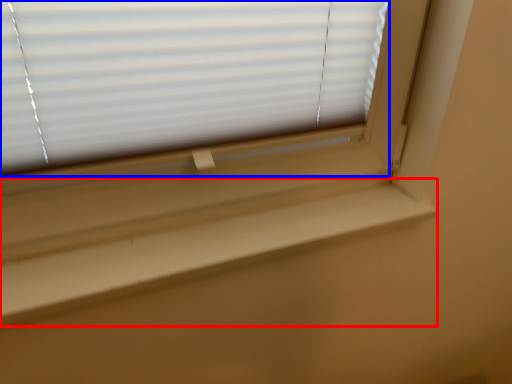
Question: Which point is further to the camera, window sill (highlighted by a red box) or window blind (highlighted by a blue box)?

Choices:
 (A) window sill
 (B) window blind

Answer: (A)